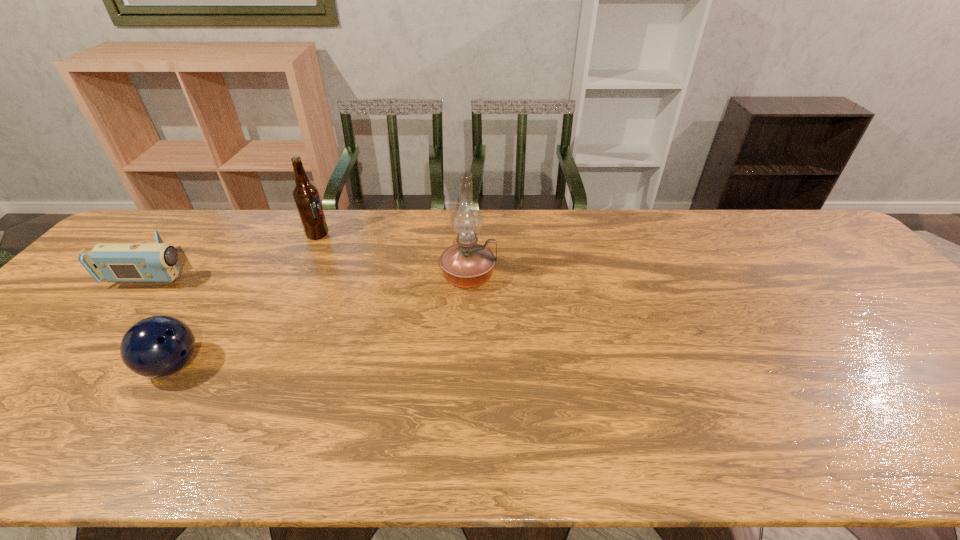
At what (x,y) coordinates should I click in order to perform the action: click on oil lamp. Please return your answer as a coordinate pair (x, y). The image size is (960, 540). Looking at the image, I should click on pos(466,264).

Image resolution: width=960 pixels, height=540 pixels. Identify the location of the tallest object. (466, 264).

Where is `beer bottle`? The image size is (960, 540). beer bottle is located at coordinates (306, 196).

Locate an element on the screen. This screenshot has width=960, height=540. the second object from right to left is located at coordinates (306, 196).

Identify the location of bowling ball. (157, 346).

Where is `the nearest object`? the nearest object is located at coordinates (157, 346).

Identify the location of the leftmost object. The width and height of the screenshot is (960, 540). (116, 262).

Image resolution: width=960 pixels, height=540 pixels. Find the location of `vacant region located 0.170m on the back of the rightmost object`. vacant region located 0.170m on the back of the rightmost object is located at coordinates (470, 226).

The width and height of the screenshot is (960, 540). In order to click on free spot located on the label of the second tallest object in this screenshot , I will do `click(347, 235)`.

Identify the location of free space located 0.080m on the surface of the second object from left to right near the finger holes. (237, 366).